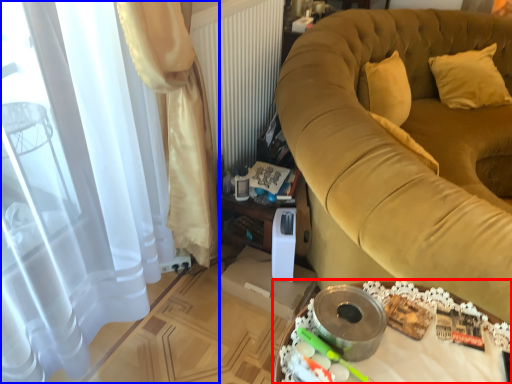
Question: Which object is closer to the camera taking this photo, table (highlighted by a red box) or curtain (highlighted by a blue box)?

Choices:
 (A) table
 (B) curtain

Answer: (A)